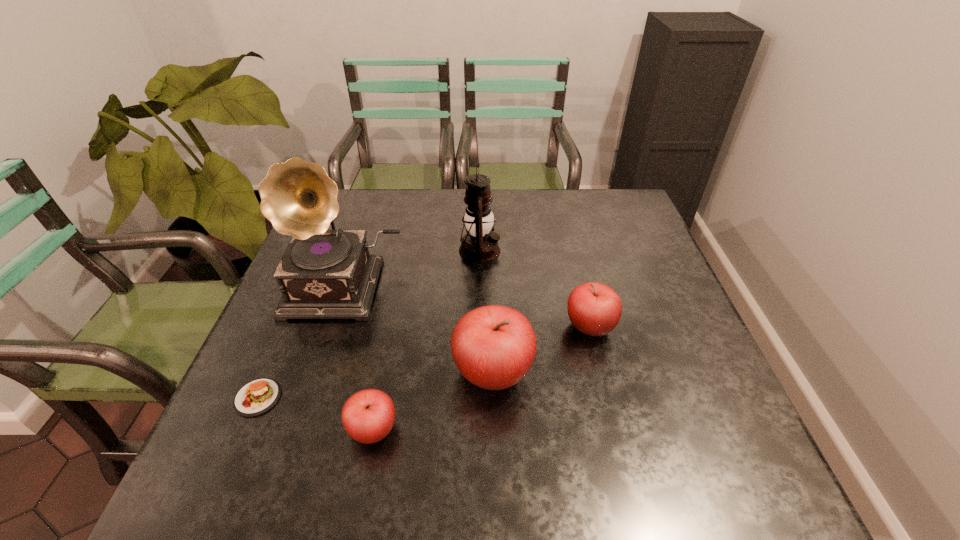
With all apples evenly spaced, where should an extra apple be placed on the right to continue the pattern? Please point out a vacant space. Please provide its 2D coordinates. Your answer should be formatted as a tuple, i.e. [(x, y)], where the tuple contains the x and y coordinates of a point satisfying the conditions above.

[(669, 288)]